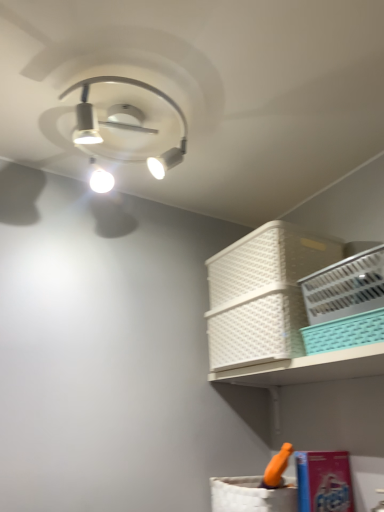
What is the approximate height of white plastic basket at upper right, the third basket positioned from the front?

white plastic basket at upper right, the third basket positioned from the front, is 7.03 inches tall.

What do you see at coordinates (345, 287) in the screenshot? I see `white plastic basket at upper right, marked as the first basket in a front-to-back arrangement` at bounding box center [345, 287].

The image size is (384, 512). What do you see at coordinates (344, 332) in the screenshot?
I see `teal plastic basket at upper right, the second basket in the front-to-back sequence` at bounding box center [344, 332].

The height and width of the screenshot is (512, 384). I want to click on white plastic basket at upper right, placed as the second basket when sorted from back to front, so click(257, 328).

From the image's perspective, would you say white plastic basket at upper right, placed as the second basket when sorted from back to front, is positioned over white plastic basket at upper right, acting as the fourth basket starting from the back?

No, from the image's perspective, white plastic basket at upper right, placed as the second basket when sorted from back to front, is not over white plastic basket at upper right, acting as the fourth basket starting from the back.

Considering the relative sizes of white plastic basket at upper right, placed as the second basket when sorted from back to front, and white plastic basket at upper right, acting as the fourth basket starting from the back, in the image provided, is white plastic basket at upper right, placed as the second basket when sorted from back to front, shorter than white plastic basket at upper right, acting as the fourth basket starting from the back,?

In fact, white plastic basket at upper right, placed as the second basket when sorted from back to front, may be taller than white plastic basket at upper right, acting as the fourth basket starting from the back.

How far apart are white plastic basket at upper right, placed as the second basket when sorted from back to front, and white plastic basket at upper right, acting as the fourth basket starting from the back?

5.14 inches.

Is white plastic basket at upper right, placed as the second basket when sorted from back to front, to the left or to the right of white plastic basket at upper right, acting as the fourth basket starting from the back, in the image?

white plastic basket at upper right, placed as the second basket when sorted from back to front, is positioned on white plastic basket at upper right, acting as the fourth basket starting from the back,'s left side.

Which point is more forward, (327,330) or (331,248)?

The point (327,330) is closer.

Is teal plastic basket at upper right, which appears as the 3th basket when viewed from the back, next to white plastic basket at upper right, marked as the first basket in a back-to-front arrangement?

teal plastic basket at upper right, which appears as the 3th basket when viewed from the back, and white plastic basket at upper right, marked as the first basket in a back-to-front arrangement, are clearly separated.

Does teal plastic basket at upper right, the second basket in the front-to-back sequence, have a greater height compared to white plastic basket at upper right, marked as the first basket in a back-to-front arrangement?

In fact, teal plastic basket at upper right, the second basket in the front-to-back sequence, may be shorter than white plastic basket at upper right, marked as the first basket in a back-to-front arrangement.

Is teal plastic basket at upper right, which appears as the 3th basket when viewed from the back, inside or outside of white plastic basket at upper right, acting as the fourth basket starting from the back?

teal plastic basket at upper right, which appears as the 3th basket when viewed from the back, is located beyond the bounds of white plastic basket at upper right, acting as the fourth basket starting from the back.

Considering the relative sizes of teal plastic basket at upper right, which appears as the 3th basket when viewed from the back, and white plastic basket at upper right, marked as the first basket in a front-to-back arrangement, in the image provided, is teal plastic basket at upper right, which appears as the 3th basket when viewed from the back, wider than white plastic basket at upper right, marked as the first basket in a front-to-back arrangement,?

Yes.

Is the surface of teal plastic basket at upper right, the second basket in the front-to-back sequence, in direct contact with white plastic basket at upper right, marked as the first basket in a front-to-back arrangement?

Absolutely, teal plastic basket at upper right, the second basket in the front-to-back sequence, is next to and touching white plastic basket at upper right, marked as the first basket in a front-to-back arrangement.

From the image's perspective, between teal plastic basket at upper right, the second basket in the front-to-back sequence, and white plastic basket at upper right, marked as the first basket in a front-to-back arrangement, which one is located above?

white plastic basket at upper right, marked as the first basket in a front-to-back arrangement.

Who is bigger, white plastic basket at upper right, marked as the first basket in a back-to-front arrangement, or teal plastic basket at upper right, the second basket in the front-to-back sequence?

white plastic basket at upper right, marked as the first basket in a back-to-front arrangement, is bigger.

In the scene shown: Which object is positioned more to the left, white plastic basket at upper right, positioned as the 4th basket in front-to-back order, or teal plastic basket at upper right, which appears as the 3th basket when viewed from the back?

white plastic basket at upper right, positioned as the 4th basket in front-to-back order, is more to the left.

What's the angular difference between white plastic basket at upper right, positioned as the 4th basket in front-to-back order, and teal plastic basket at upper right, the second basket in the front-to-back sequence,'s facing directions?

The facing directions of white plastic basket at upper right, positioned as the 4th basket in front-to-back order, and teal plastic basket at upper right, the second basket in the front-to-back sequence, are 0.000145 degrees apart.

Considering the relative sizes of white plastic basket at upper right, positioned as the 4th basket in front-to-back order, and teal plastic basket at upper right, the second basket in the front-to-back sequence, in the image provided, is white plastic basket at upper right, positioned as the 4th basket in front-to-back order, wider than teal plastic basket at upper right, the second basket in the front-to-back sequence,?

Indeed, white plastic basket at upper right, positioned as the 4th basket in front-to-back order, has a greater width compared to teal plastic basket at upper right, the second basket in the front-to-back sequence.

Is white plastic basket at upper right, the third basket positioned from the front, taller or shorter than teal plastic basket at upper right, the second basket in the front-to-back sequence?

Clearly, white plastic basket at upper right, the third basket positioned from the front, is taller compared to teal plastic basket at upper right, the second basket in the front-to-back sequence.

What's the angular difference between white plastic basket at upper right, the third basket positioned from the front, and teal plastic basket at upper right, the second basket in the front-to-back sequence,'s facing directions?

The angular difference between white plastic basket at upper right, the third basket positioned from the front, and teal plastic basket at upper right, the second basket in the front-to-back sequence, is 0.000235 degrees.

Which of these two, white plastic basket at upper right, placed as the second basket when sorted from back to front, or teal plastic basket at upper right, which appears as the 3th basket when viewed from the back, is bigger?

white plastic basket at upper right, placed as the second basket when sorted from back to front.

Considering the positions of points (238, 313) and (342, 343), is point (238, 313) farther from camera compared to point (342, 343)?

Yes, point (238, 313) is behind point (342, 343).

Is white plastic basket at upper right, placed as the second basket when sorted from back to front, turned away from white plastic basket at upper right, marked as the first basket in a back-to-front arrangement?

white plastic basket at upper right, placed as the second basket when sorted from back to front, is not turned away from white plastic basket at upper right, marked as the first basket in a back-to-front arrangement.

Between white plastic basket at upper right, the third basket positioned from the front, and white plastic basket at upper right, marked as the first basket in a back-to-front arrangement, which one has smaller width?

white plastic basket at upper right, marked as the first basket in a back-to-front arrangement.

In terms of height, does white plastic basket at upper right, placed as the second basket when sorted from back to front, look taller or shorter compared to white plastic basket at upper right, marked as the first basket in a back-to-front arrangement?

Considering their sizes, white plastic basket at upper right, placed as the second basket when sorted from back to front, has more height than white plastic basket at upper right, marked as the first basket in a back-to-front arrangement.

Is teal plastic basket at upper right, which appears as the 3th basket when viewed from the back, thinner than white plastic basket at upper right, the third basket positioned from the front?

Yes.

Is there a large distance between teal plastic basket at upper right, the second basket in the front-to-back sequence, and white plastic basket at upper right, placed as the second basket when sorted from back to front?

teal plastic basket at upper right, the second basket in the front-to-back sequence, is near white plastic basket at upper right, placed as the second basket when sorted from back to front, not far away.

From the teal plastic basket at upper right, the second basket in the front-to-back sequence, count 1st baskets backward and point to it. Please provide its 2D coordinates.

[(257, 328)]

Image resolution: width=384 pixels, height=512 pixels. I want to click on the 2nd basket behind the white plastic basket at upper right, marked as the first basket in a front-to-back arrangement, so click(x=257, y=328).

Locate an element on the screen. the 2nd basket to the left of the teal plastic basket at upper right, which appears as the 3th basket when viewed from the back, counting from the anchor's position is located at coordinates (267, 262).

When comparing their distances from white plastic basket at upper right, marked as the first basket in a front-to-back arrangement, does teal plastic basket at upper right, the second basket in the front-to-back sequence, or white plastic basket at upper right, placed as the second basket when sorted from back to front, seem closer?

teal plastic basket at upper right, the second basket in the front-to-back sequence.

Based on their spatial positions, is white plastic basket at upper right, acting as the fourth basket starting from the back, or white plastic basket at upper right, marked as the first basket in a back-to-front arrangement, further from teal plastic basket at upper right, which appears as the 3th basket when viewed from the back?

Among the two, white plastic basket at upper right, marked as the first basket in a back-to-front arrangement, is located further to teal plastic basket at upper right, which appears as the 3th basket when viewed from the back.

Looking at the image, which one is located further to teal plastic basket at upper right, the second basket in the front-to-back sequence, white plastic basket at upper right, positioned as the 4th basket in front-to-back order, or white plastic basket at upper right, placed as the second basket when sorted from back to front?

Based on the image, white plastic basket at upper right, positioned as the 4th basket in front-to-back order, appears to be further to teal plastic basket at upper right, the second basket in the front-to-back sequence.

From the image, which object appears to be farther from white plastic basket at upper right, positioned as the 4th basket in front-to-back order, white plastic basket at upper right, placed as the second basket when sorted from back to front, or white plastic basket at upper right, marked as the first basket in a front-to-back arrangement?

Among the two, white plastic basket at upper right, marked as the first basket in a front-to-back arrangement, is located further to white plastic basket at upper right, positioned as the 4th basket in front-to-back order.

Looking at the image, which one is located further to teal plastic basket at upper right, the second basket in the front-to-back sequence, white plastic basket at upper right, marked as the first basket in a back-to-front arrangement, or white plastic basket at upper right, acting as the fourth basket starting from the back?

The object further to teal plastic basket at upper right, the second basket in the front-to-back sequence, is white plastic basket at upper right, marked as the first basket in a back-to-front arrangement.

Based on their spatial positions, is white plastic basket at upper right, marked as the first basket in a back-to-front arrangement, or teal plastic basket at upper right, which appears as the 3th basket when viewed from the back, closer to white plastic basket at upper right, placed as the second basket when sorted from back to front?

Based on the image, white plastic basket at upper right, marked as the first basket in a back-to-front arrangement, appears to be nearer to white plastic basket at upper right, placed as the second basket when sorted from back to front.

Considering their positions, is white plastic basket at upper right, acting as the fourth basket starting from the back, positioned closer to white plastic basket at upper right, marked as the first basket in a back-to-front arrangement, than white plastic basket at upper right, the third basket positioned from the front?

white plastic basket at upper right, the third basket positioned from the front, lies closer to white plastic basket at upper right, marked as the first basket in a back-to-front arrangement, than the other object.

Considering their positions, is teal plastic basket at upper right, the second basket in the front-to-back sequence, positioned further to white plastic basket at upper right, marked as the first basket in a back-to-front arrangement, than white plastic basket at upper right, placed as the second basket when sorted from back to front?

Among the two, teal plastic basket at upper right, the second basket in the front-to-back sequence, is located further to white plastic basket at upper right, marked as the first basket in a back-to-front arrangement.

Locate an element on the screen. This screenshot has width=384, height=512. basket between white plastic basket at upper right, acting as the fourth basket starting from the back, and white plastic basket at upper right, the third basket positioned from the front, in the front-back direction is located at coordinates (344, 332).

Image resolution: width=384 pixels, height=512 pixels. I want to click on basket between teal plastic basket at upper right, which appears as the 3th basket when viewed from the back, and white plastic basket at upper right, positioned as the 4th basket in front-to-back order, along the z-axis, so click(x=257, y=328).